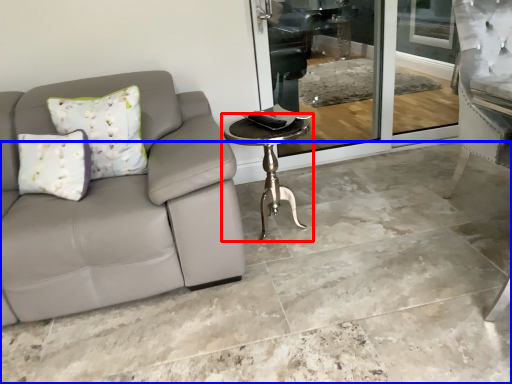
Question: Which object appears closest to the camera in this image, table (highlighted by a red box) or concrete (highlighted by a blue box)?

Choices:
 (A) table
 (B) concrete

Answer: (B)